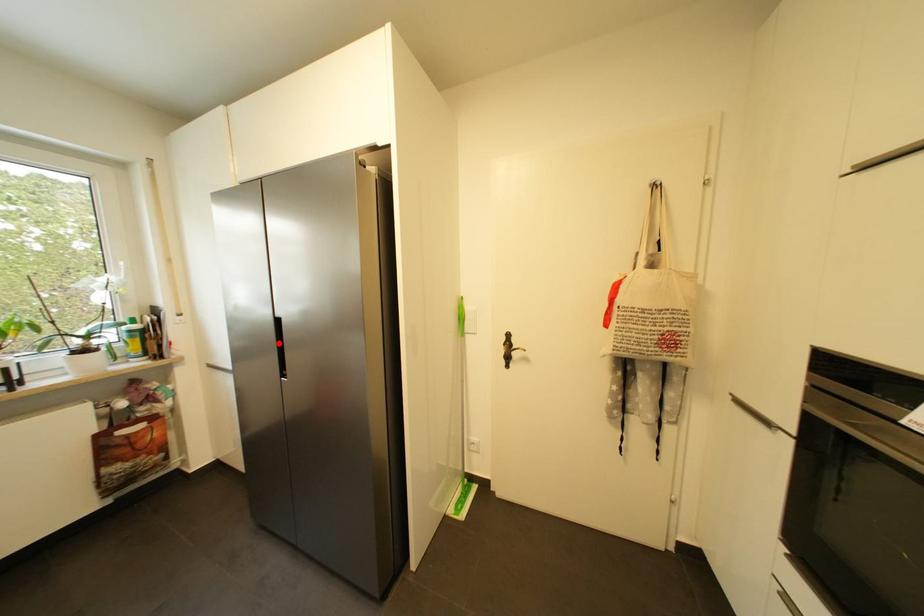
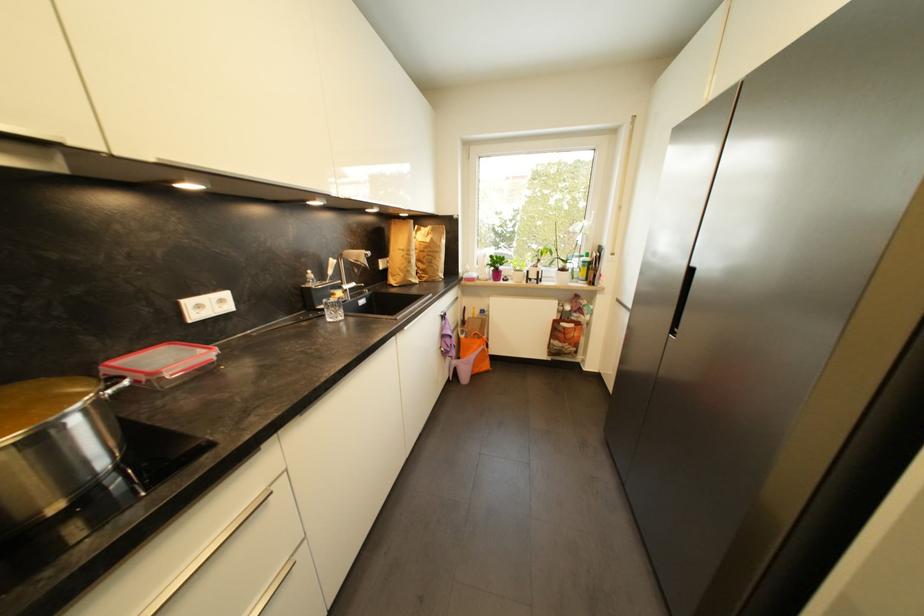
Locate, in the second image, the point that corresponds to the highlighted location in the first image.

(682, 296)